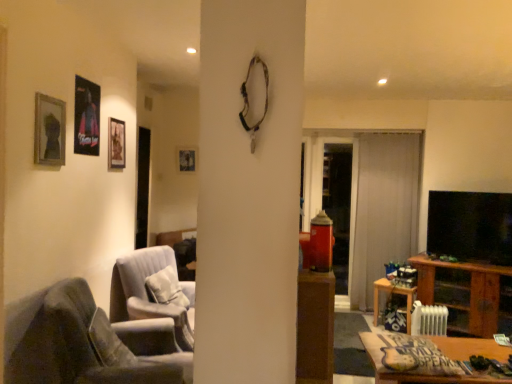
Question: Are velvet white armchair at center, placed as the second chair when sorted from front to back, and matte black picture frame at upper left, which is the 3th picture frame from front to back, far apart?

Choices:
 (A) yes
 (B) no

Answer: (B)

Question: Considering the relative sizes of velvet white armchair at center, placed as the second chair when sorted from front to back, and matte black picture frame at upper left, positioned as the 2th picture frame in back-to-front order, in the image provided, is velvet white armchair at center, placed as the second chair when sorted from front to back, thinner than matte black picture frame at upper left, positioned as the 2th picture frame in back-to-front order,?

Choices:
 (A) yes
 (B) no

Answer: (B)

Question: Is velvet white armchair at center, marked as the first chair in a back-to-front arrangement, taller than matte black picture frame at upper left, which is counted as the 2th picture frame, starting from the right?

Choices:
 (A) yes
 (B) no

Answer: (A)

Question: Can you confirm if velvet white armchair at center, placed as the second chair when sorted from front to back, is wider than matte black picture frame at upper left, the third picture frame from the left?

Choices:
 (A) no
 (B) yes

Answer: (B)

Question: Would you say matte black picture frame at upper left, the third picture frame from the left, is part of velvet white armchair at center, marked as the first chair in a back-to-front arrangement,'s contents?

Choices:
 (A) yes
 (B) no

Answer: (B)

Question: From the image's perspective, is wooden frame at upper left, placed as the 4th picture frame when sorted from right to left, positioned above or below matte black picture frame at upper left, the third picture frame from the left?

Choices:
 (A) below
 (B) above

Answer: (A)

Question: From their relative heights in the image, would you say wooden frame at upper left, which is counted as the first picture frame, starting from the front, is taller or shorter than matte black picture frame at upper left, the third picture frame from the left?

Choices:
 (A) tall
 (B) short

Answer: (B)

Question: From a real-world perspective, is wooden frame at upper left, the fourth picture frame when ordered from back to front, physically located above or below matte black picture frame at upper left, the third picture frame from the left?

Choices:
 (A) below
 (B) above

Answer: (B)

Question: Is wooden frame at upper left, the fourth picture frame when ordered from back to front, in front of or behind matte black picture frame at upper left, which is counted as the 2th picture frame, starting from the right, in the image?

Choices:
 (A) behind
 (B) front

Answer: (B)

Question: Looking at their shapes, would you say white sheer curtain at center is wider or thinner than velvet white armchair at center, placed as the second chair when sorted from front to back?

Choices:
 (A) thin
 (B) wide

Answer: (A)

Question: Considering the positions of white sheer curtain at center and velvet white armchair at center, marked as the first chair in a back-to-front arrangement, in the image, is white sheer curtain at center taller or shorter than velvet white armchair at center, marked as the first chair in a back-to-front arrangement,?

Choices:
 (A) tall
 (B) short

Answer: (A)

Question: Would you say white sheer curtain at center is inside or outside velvet white armchair at center, placed as the second chair when sorted from front to back?

Choices:
 (A) inside
 (B) outside

Answer: (B)

Question: From the image's perspective, is white sheer curtain at center above or below velvet white armchair at center, placed as the second chair when sorted from front to back?

Choices:
 (A) below
 (B) above

Answer: (B)

Question: In the image, is matte black picture frame at upper center, the first picture frame when ordered from back to front, positioned in front of or behind wooden cabinet at right?

Choices:
 (A) front
 (B) behind

Answer: (B)

Question: Does point (188, 165) appear closer or farther from the camera than point (483, 274)?

Choices:
 (A) farther
 (B) closer

Answer: (A)